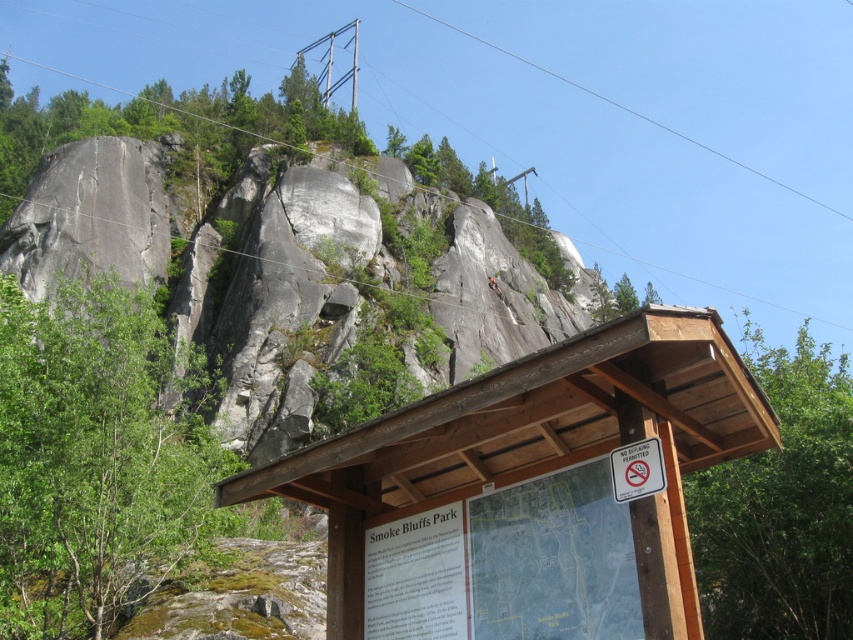
Does clear wire at upper center appear under white plastic sign at lower right?

No, clear wire at upper center is not below white plastic sign at lower right.

Between point (735, 161) and point (643, 461), which one is positioned in front?

Point (643, 461) is in front.

This screenshot has height=640, width=853. What do you see at coordinates (628, 109) in the screenshot?
I see `clear wire at upper center` at bounding box center [628, 109].

At what (x,y) coordinates should I click in order to perform the action: click on clear wire at upper center. Please return your answer as a coordinate pair (x, y). Looking at the image, I should click on (628, 109).

Is point (560, 376) positioned after point (628, 461)?

No, it is in front of (628, 461).

Describe the element at coordinates (527, 486) in the screenshot. I see `wooden signboard at lower right` at that location.

You are a GUI agent. You are given a task and a screenshot of the screen. Output one action in this format:
    pyautogui.click(x=<x>, y=<y>)
    Task: Click on the wooden signboard at lower right
    
    Given the screenshot: What is the action you would take?
    pyautogui.click(x=527, y=486)

Can you confirm if wooden signboard at lower right is bigger than clear wire at upper center?

Incorrect, wooden signboard at lower right is not larger than clear wire at upper center.

Which is above, wooden signboard at lower right or clear wire at upper center?

clear wire at upper center

Does point (447, 486) lie in front of point (636, 113)?

Yes, point (447, 486) is in front of point (636, 113).

You are a GUI agent. You are given a task and a screenshot of the screen. Output one action in this format:
    pyautogui.click(x=<x>, y=<y>)
    Task: Click on the wooden signboard at lower right
    The image size is (853, 640).
    Given the screenshot: What is the action you would take?
    pyautogui.click(x=527, y=486)